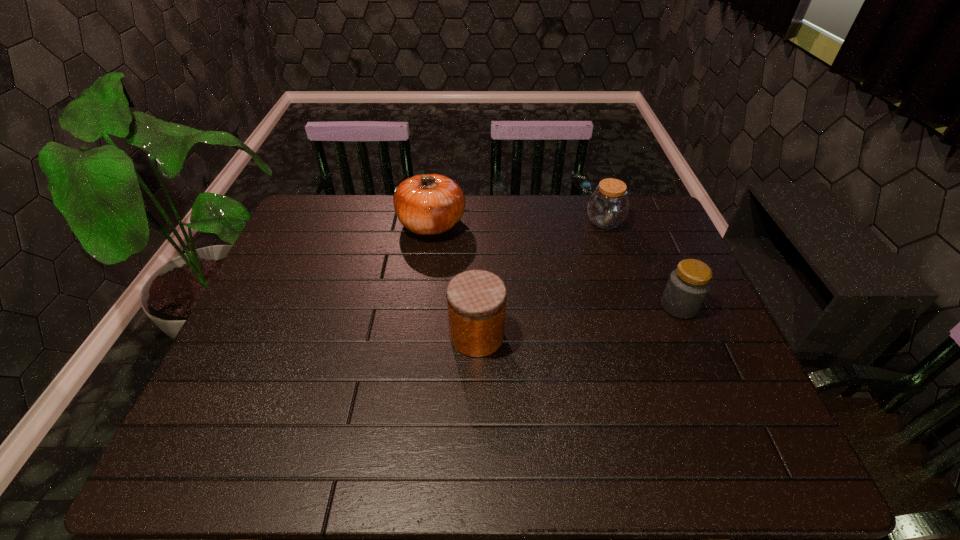
Find the location of `pumpkin`. pumpkin is located at coordinates (429, 204).

Where is `the leftmost jar`? The image size is (960, 540). the leftmost jar is located at coordinates (476, 299).

At what (x,y) coordinates should I click in order to perform the action: click on the farthest jar. Please return your answer as a coordinate pair (x, y). The image size is (960, 540). Looking at the image, I should click on (607, 207).

The image size is (960, 540). In order to click on the second jar from right to left in this screenshot , I will do `click(607, 207)`.

The height and width of the screenshot is (540, 960). In order to click on the rightmost jar in this screenshot , I will do `click(688, 285)`.

I want to click on vacant space located 0.080m on the front of the pumpkin, so click(x=426, y=263).

You are a GUI agent. You are given a task and a screenshot of the screen. Output one action in this format:
    pyautogui.click(x=<x>, y=<y>)
    Task: Click on the free location located 0.200m on the right of the leftmost jar
    This screenshot has height=540, width=960.
    Given the screenshot: What is the action you would take?
    pyautogui.click(x=583, y=336)

Where is `free space located on the left of the second jar from right to left`? free space located on the left of the second jar from right to left is located at coordinates (493, 222).

I want to click on free space located on the surface of the rightmost jar near the warning symbol, so click(x=638, y=306).

This screenshot has width=960, height=540. In order to click on free space located 0.210m on the surface of the rightmost jar near the warning symbol in this screenshot , I will do `click(583, 306)`.